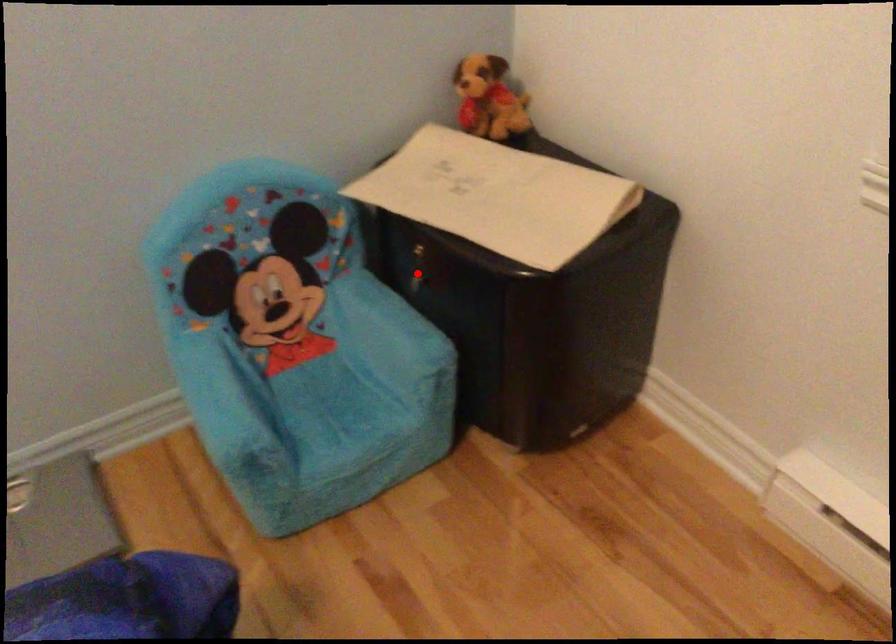
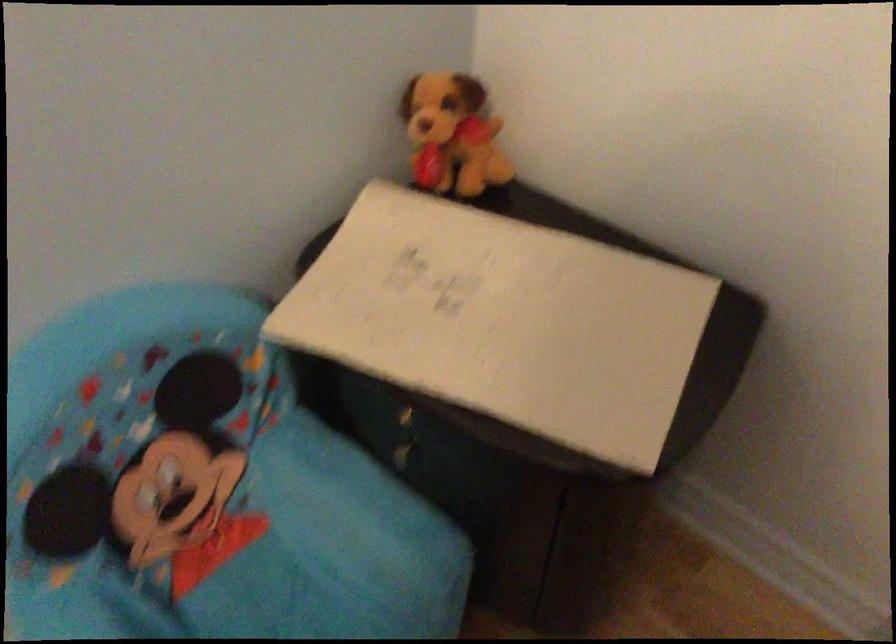
The point at the highlighted location is marked in the first image. Where is the corresponding point in the second image?

(403, 438)